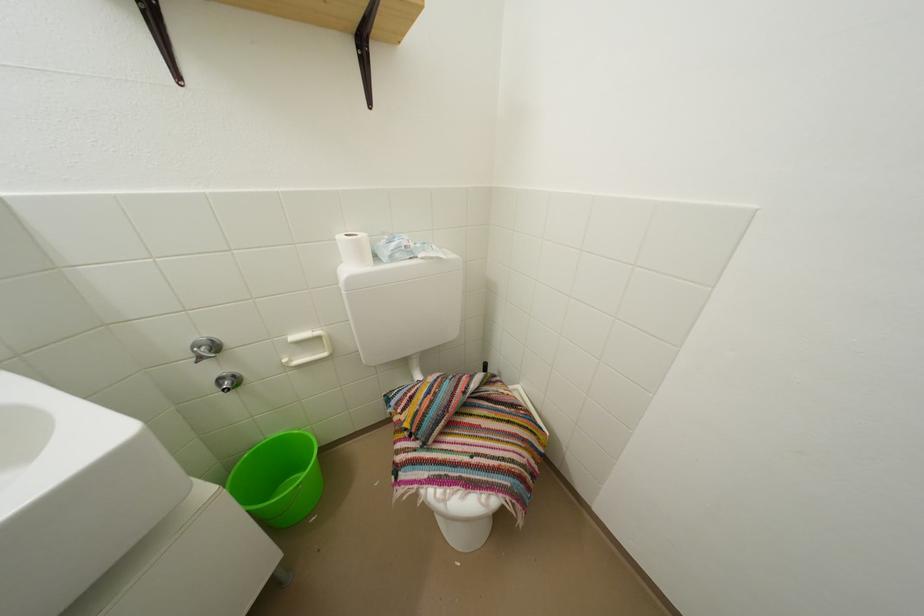
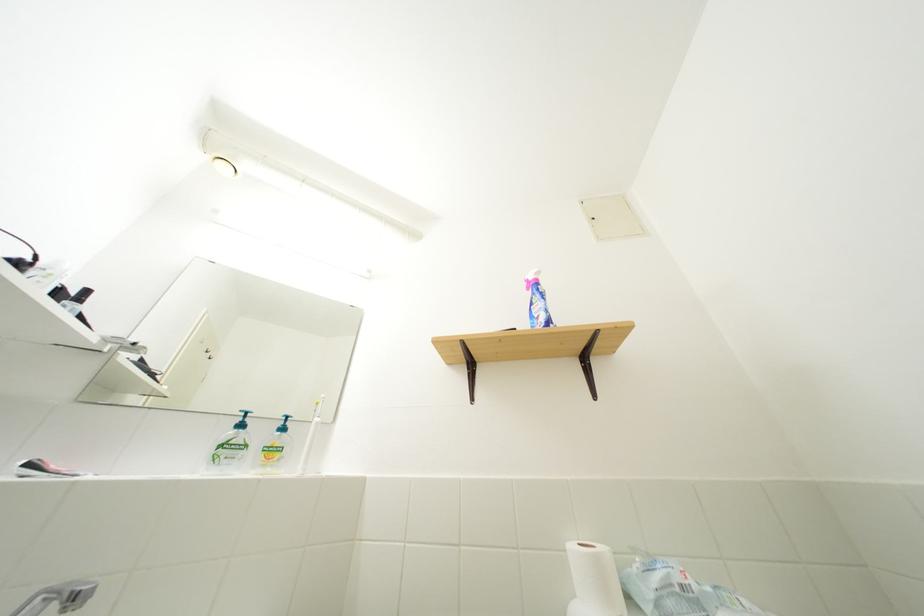
In the second image, find the point that corresponds to point (402, 251) in the first image.

(665, 585)